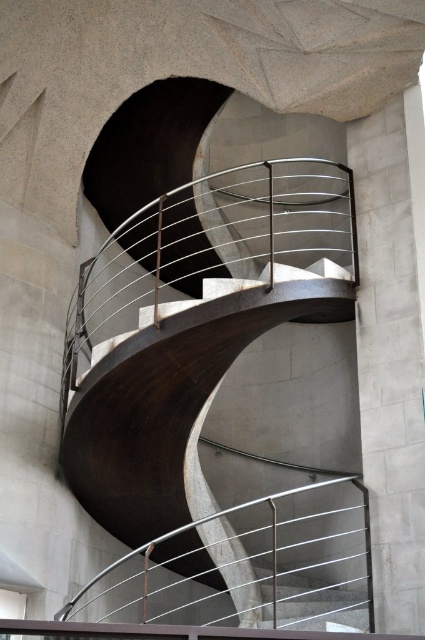
Question: In this image, where is satin silver metal stair at center located relative to satin silver metal stairs at center?

Choices:
 (A) left
 (B) right

Answer: (B)

Question: Which point appears closest to the camera in this image?

Choices:
 (A) (311, 595)
 (B) (374, 163)

Answer: (A)

Question: Which point appears farthest from the camera in this image?

Choices:
 (A) (376, 138)
 (B) (340, 589)

Answer: (A)

Question: Does satin silver metal stair at center have a lesser width compared to satin silver metal stairs at center?

Choices:
 (A) yes
 (B) no

Answer: (A)

Question: Can you confirm if satin silver metal stair at center is positioned to the right of satin silver metal stairs at center?

Choices:
 (A) no
 (B) yes

Answer: (B)